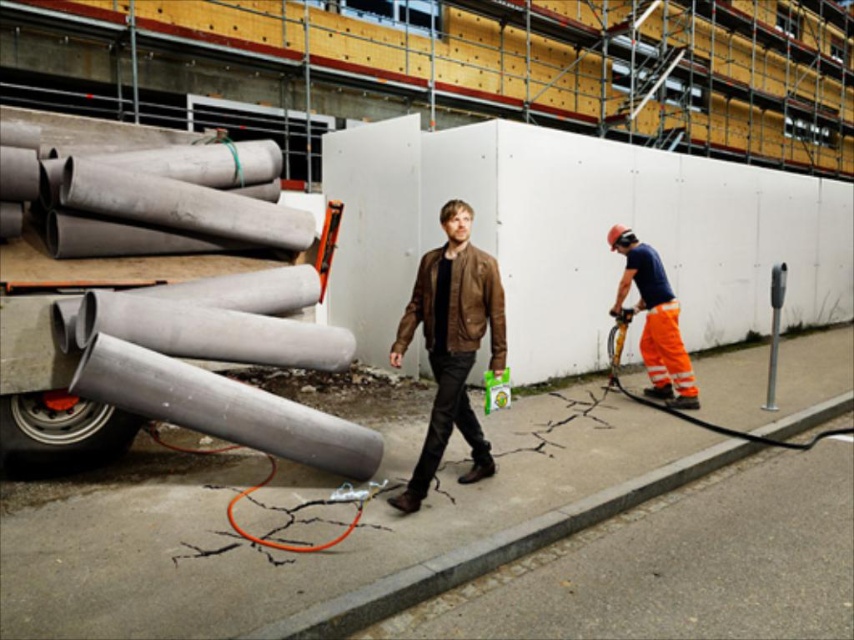
Is brown leather jacket at center thinner than orange reflective pants at right?

Yes, brown leather jacket at center is thinner than orange reflective pants at right.

Which is below, brown leather jacket at center or orange reflective pants at right?

brown leather jacket at center is lower down.

The height and width of the screenshot is (640, 854). What do you see at coordinates (452, 344) in the screenshot?
I see `brown leather jacket at center` at bounding box center [452, 344].

Find the location of a particular element. The image size is (854, 640). brown leather jacket at center is located at coordinates (452, 344).